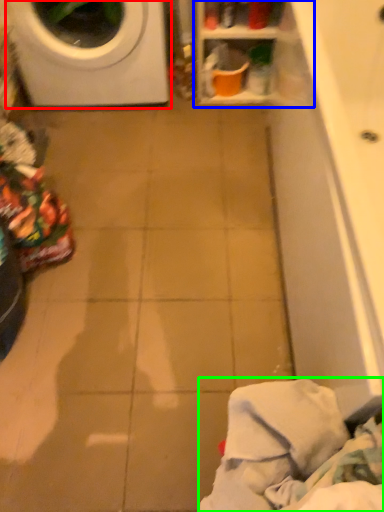
Question: Which is nearer to the washing machine (highlighted by a red box)? shelf (highlighted by a blue box) or clothing (highlighted by a green box).

Choices:
 (A) shelf
 (B) clothing

Answer: (A)